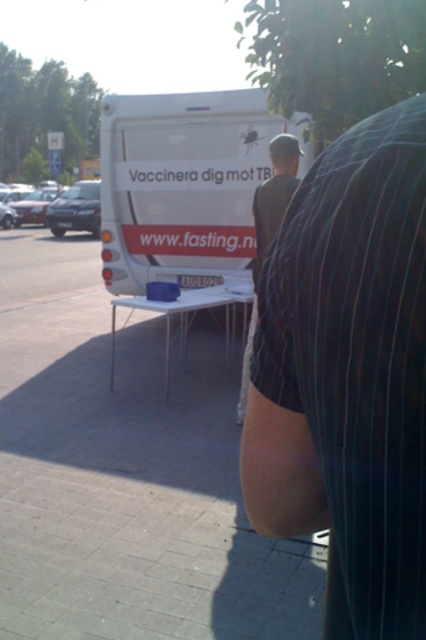
Question: Among these points, which one is farthest from the camera?

Choices:
 (A) (218, 241)
 (B) (371, 186)
 (C) (282, 147)

Answer: (A)

Question: Which of the following is the farthest from the observer?

Choices:
 (A) black pinstripe shirt at center
 (B) white matte van at center
 (C) dark gray shirt at center

Answer: (B)

Question: Does black pinstripe shirt at center appear over dark gray shirt at center?

Choices:
 (A) no
 (B) yes

Answer: (A)

Question: Which is farther from the black pinstripe shirt at center?

Choices:
 (A) dark gray shirt at center
 (B) white matte van at center

Answer: (B)

Question: From the image, what is the correct spatial relationship of white matte van at center in relation to dark gray shirt at center?

Choices:
 (A) left
 (B) right

Answer: (A)

Question: Is black pinstripe shirt at center to the left of dark gray shirt at center from the viewer's perspective?

Choices:
 (A) no
 (B) yes

Answer: (B)